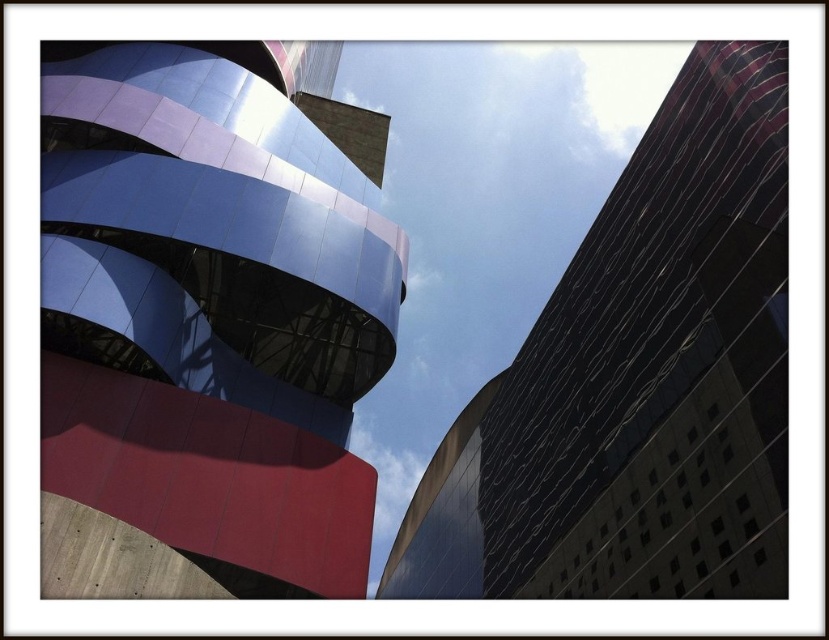
Question: Among these objects, which one is nearest to the camera?

Choices:
 (A) reflective glass building at right
 (B) metallic blue building at upper left

Answer: (B)

Question: Is metallic blue building at upper left above reflective glass building at right?

Choices:
 (A) yes
 (B) no

Answer: (A)

Question: Which point is closer to the camera taking this photo?

Choices:
 (A) (142, 360)
 (B) (537, 554)

Answer: (A)

Question: Can you confirm if metallic blue building at upper left is thinner than reflective glass building at right?

Choices:
 (A) no
 (B) yes

Answer: (A)

Question: Observing the image, what is the correct spatial positioning of metallic blue building at upper left in reference to reflective glass building at right?

Choices:
 (A) right
 (B) left

Answer: (B)

Question: Which of the following is the closest to the observer?

Choices:
 (A) metallic blue building at upper left
 (B) reflective glass building at right

Answer: (A)